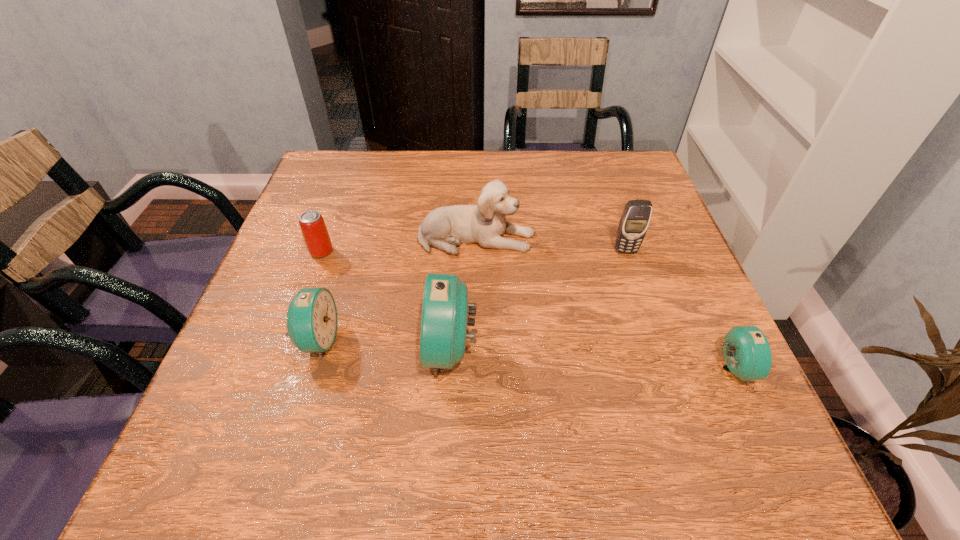
Select which alarm clock appears as the second closest to the puppy. Please provide its 2D coordinates. Your answer should be formatted as a tuple, i.e. [(x, y)], where the tuple contains the x and y coordinates of a point satisfying the conditions above.

[(312, 314)]

This screenshot has width=960, height=540. In order to click on alarm clock that stands as the third closest to the beer can in this screenshot , I will do `click(747, 354)`.

Find the location of a particular element. Image resolution: width=960 pixels, height=540 pixels. free spot that satisfies the following two spatial constraints: 1. on the front face of the cellular telephone; 2. on the front-facing side of the tallest alarm clock is located at coordinates (659, 349).

The image size is (960, 540). What are the coordinates of `vacant position in the image that satisfies the following two spatial constraints: 1. on the front face of the cellular telephone; 2. on the front-facing side of the tallest object` in the screenshot? It's located at (659, 349).

Identify the location of free space that satisfies the following two spatial constraints: 1. on the front face of the second object from right to left; 2. on the front-facing side of the leftmost alarm clock. This screenshot has height=540, width=960. (656, 340).

At what (x,y) coordinates should I click in order to perform the action: click on vacant point that satisfies the following two spatial constraints: 1. on the front face of the second object from right to left; 2. on the front-facing side of the tallest object. Please return your answer as a coordinate pair (x, y). This screenshot has width=960, height=540. Looking at the image, I should click on (659, 349).